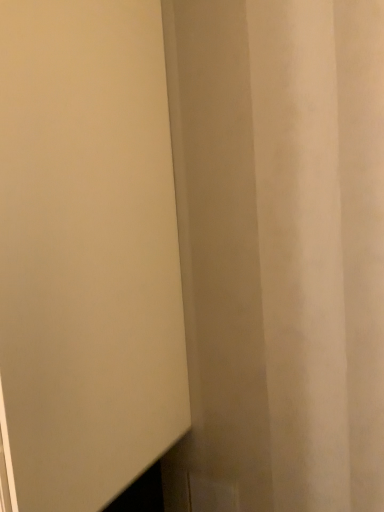
Where is `white matte door at upper left`? The height and width of the screenshot is (512, 384). white matte door at upper left is located at coordinates (86, 253).

This screenshot has width=384, height=512. What do you see at coordinates (86, 253) in the screenshot?
I see `white matte door at upper left` at bounding box center [86, 253].

This screenshot has width=384, height=512. I want to click on white matte door at upper left, so click(x=86, y=253).